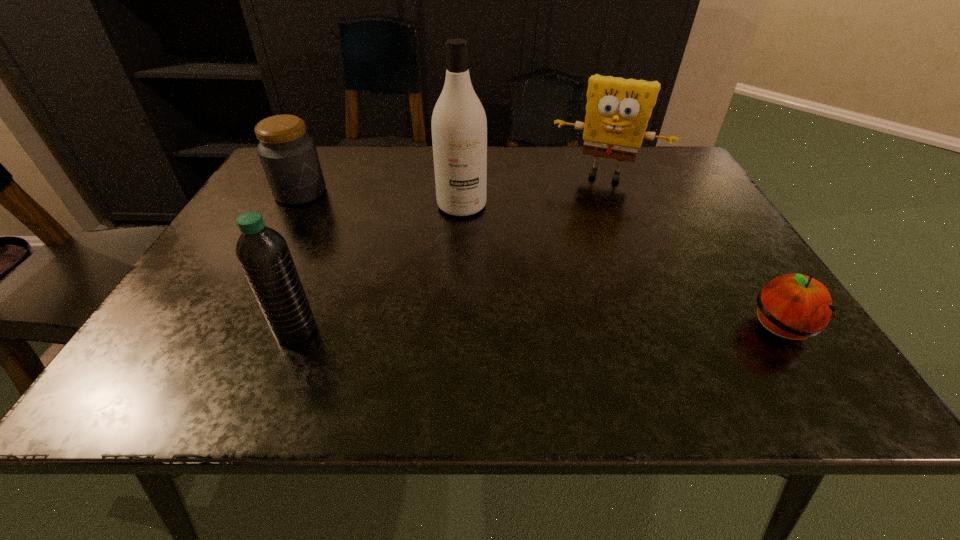
I want to click on water bottle, so click(x=263, y=254).

The height and width of the screenshot is (540, 960). Find the location of `apple`. apple is located at coordinates (794, 306).

Where is `the shortest object`? This screenshot has width=960, height=540. the shortest object is located at coordinates (794, 306).

Image resolution: width=960 pixels, height=540 pixels. I want to click on shampoo, so click(x=459, y=126).

Where is `the tallest object`? Image resolution: width=960 pixels, height=540 pixels. the tallest object is located at coordinates (459, 126).

This screenshot has height=540, width=960. In order to click on the second shortest object in this screenshot , I will do `click(289, 158)`.

The height and width of the screenshot is (540, 960). Identify the location of jar. (289, 158).

The image size is (960, 540). Find the location of `the fourth object from left to right`. the fourth object from left to right is located at coordinates (617, 112).

Where is `free space located 0.140m on the back of the water bottle`? free space located 0.140m on the back of the water bottle is located at coordinates (322, 267).

Find the location of a particular element. vacant area located 0.400m on the left of the apple is located at coordinates (532, 329).